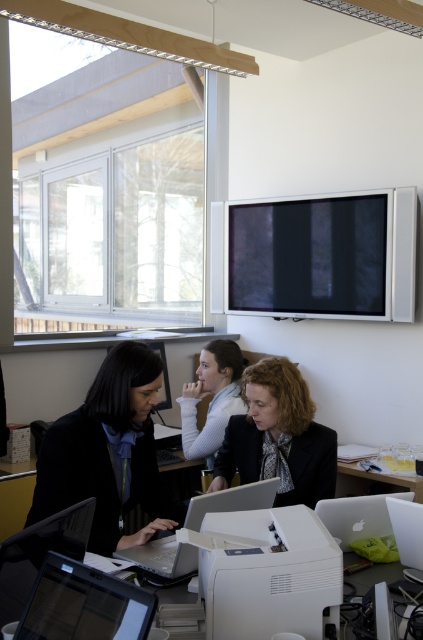
Who is taller, matte black monitor at upper center or white plastic computer at lower right?

Standing taller between the two is matte black monitor at upper center.

Who is more distant from viewer, (412,307) or (420,508)?

Positioned behind is point (412,307).

At what (x,y) coordinates should I click in order to perform the action: click on matte black monitor at upper center. Please return your answer as a coordinate pair (x, y). Looking at the image, I should click on (324, 256).

Find the location of a particular element. Image resolution: width=423 pixels, height=640 pixels. matte black monitor at upper center is located at coordinates (324, 256).

From the picture: Between white matte printer at center and matte black jacket at center, which one appears on the left side from the viewer's perspective?

white matte printer at center is more to the left.

What do you see at coordinates (269, 573) in the screenshot?
I see `white matte printer at center` at bounding box center [269, 573].

The width and height of the screenshot is (423, 640). I want to click on white matte printer at center, so click(269, 573).

Does point (357, 625) come closer to viewer compared to point (379, 508)?

Yes.

Who is taller, white plastic table at lower center or silver metallic laptop at lower right?

Standing taller between the two is silver metallic laptop at lower right.

Between point (194, 609) and point (403, 497), which one is positioned behind?

Point (403, 497)

Find the location of `white plastic table at lower center`. white plastic table at lower center is located at coordinates (370, 614).